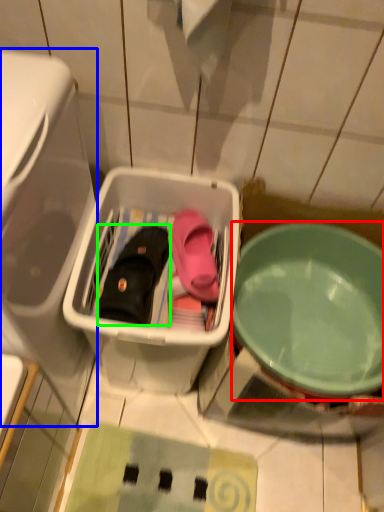
Question: Which object is the closest to the bowl (highlighted by a red box)? Choose among these: dish washer (highlighted by a blue box) or footwear (highlighted by a green box).

Choices:
 (A) dish washer
 (B) footwear

Answer: (B)